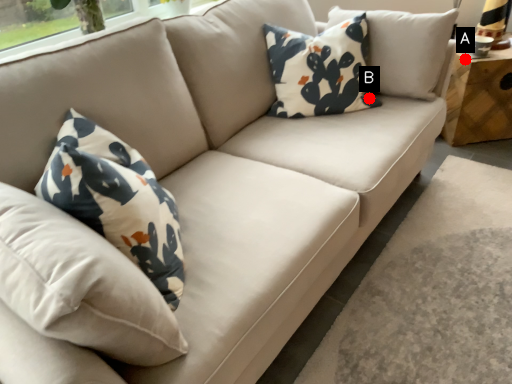
Question: Two points are circled on the image, labeled by A and B beside each circle. Which point appears farthest from the camera in this image?

Choices:
 (A) A is further
 (B) B is further

Answer: (A)